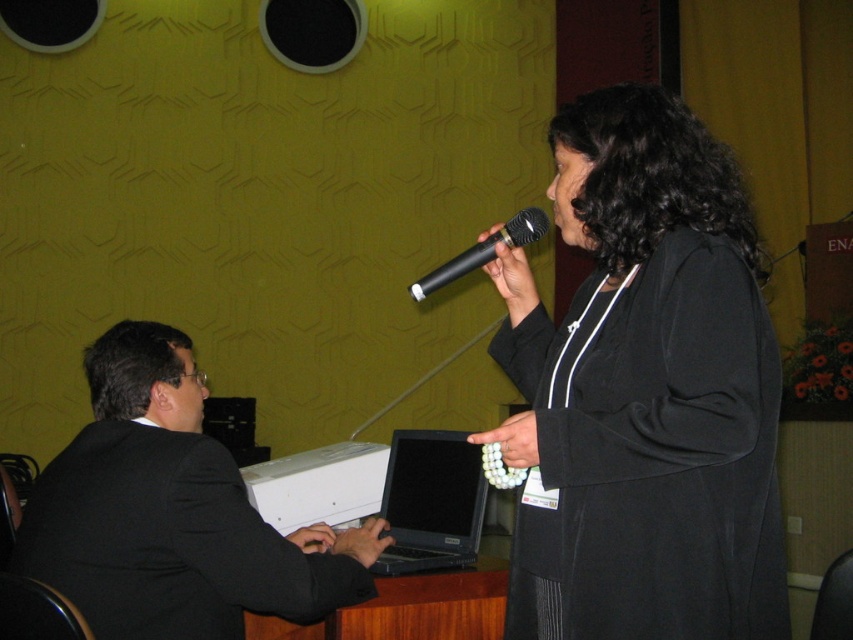
Question: Considering the relative positions of black matte jacket at upper right and black suit at left in the image provided, where is black matte jacket at upper right located with respect to black suit at left?

Choices:
 (A) left
 (B) right

Answer: (B)

Question: Is black suit at left wider than black matte microphone at upper center?

Choices:
 (A) no
 (B) yes

Answer: (B)

Question: Is black matte jacket at upper right closer to camera compared to black suit at left?

Choices:
 (A) yes
 (B) no

Answer: (A)

Question: Which object appears closest to the camera in this image?

Choices:
 (A) black matte jacket at upper right
 (B) black matte microphone at upper center
 (C) black suit at left
 (D) black matte laptop at lower center

Answer: (A)

Question: Which is nearer to the black matte jacket at upper right?

Choices:
 (A) black matte microphone at upper center
 (B) black suit at left
 (C) black matte laptop at lower center

Answer: (A)

Question: Considering the real-world distances, which object is closest to the black suit at left?

Choices:
 (A) black matte jacket at upper right
 (B) black matte laptop at lower center

Answer: (B)